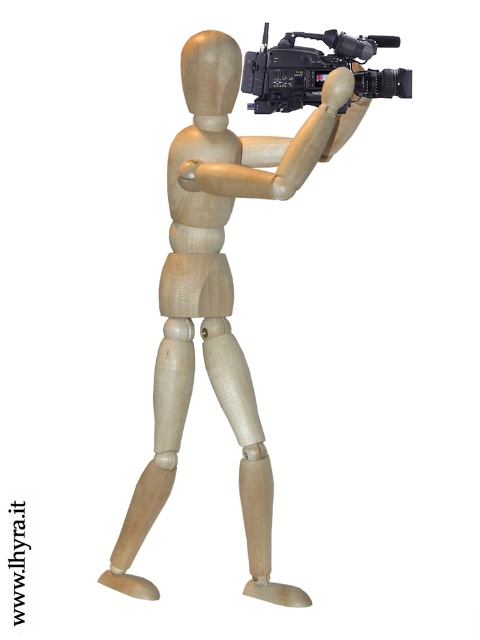
You are a photographer setting up for a photoshoot and need to ensure that the natural wood mannequin at center and the black plastic video camera at upper center are visible in your frame. Given their sizes, which object will occupy more space in the photo?

The natural wood mannequin at center has a larger size compared to the black plastic video camera at upper center, so it will occupy more space in the photo.

You are an assistant who needs to describe the position of the natural wood mannequin at center and the black plastic video camera at upper center in the image. Which object is higher?

The black plastic video camera at upper center is higher than the natural wood mannequin at center.

Consider the image. You are a technician who needs to ensure the distance between the natural wood mannequin at center and the black plastic video camera at upper center is exactly 10 inches. Based on the image, do you need to adjust the position of the camera or the mannequin?

The natural wood mannequin at center is currently 9.97 inches away from the black plastic video camera at upper center. Since this is slightly less than the required 10 inches, you should move either the camera or the mannequin a tiny bit further apart to achieve the exact distance.